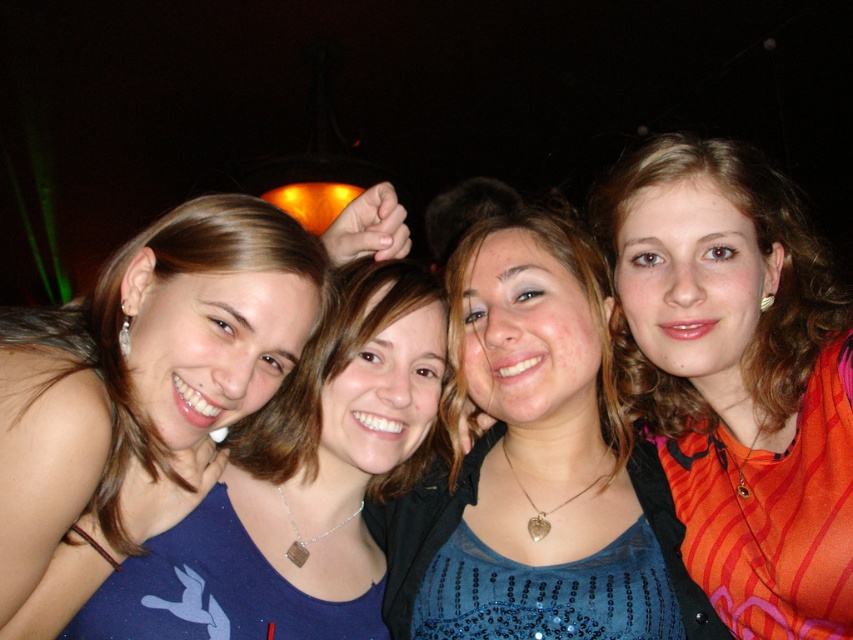
You are standing at the center of the image and want to take a photo of both the point at (717, 182) and the point at (721, 636). Which point should you focus on first to ensure both are in focus?

You should focus on the point at (717, 182) first because it is closer to you than the point at (721, 636). By focusing on the closer point, the farther point will also be within the depth of field, ensuring both are in focus.

You are at a party and want to take a photo with the orange striped shirt at right and the blue sequined top at center. Since you can only focus on one person at a time, which person should you aim the camera at first to ensure both are in the frame?

You should aim the camera at the orange striped shirt at right first because it is positioned to the right of the blue sequined top at center, ensuring both are within the frame when centered.